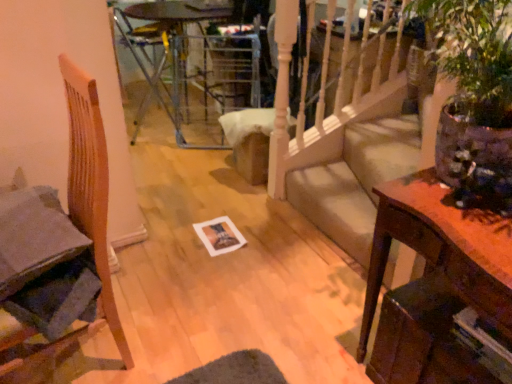
Question: Would you say wooden side table at right is a long distance from wooden chair at left?

Choices:
 (A) no
 (B) yes

Answer: (A)

Question: Is wooden side table at right oriented towards wooden chair at left?

Choices:
 (A) no
 (B) yes

Answer: (A)

Question: From the image's perspective, would you say wooden side table at right is shown under wooden chair at left?

Choices:
 (A) no
 (B) yes

Answer: (B)

Question: From a real-world perspective, is wooden side table at right located higher than wooden chair at left?

Choices:
 (A) yes
 (B) no

Answer: (B)

Question: From a real-world perspective, is wooden side table at right positioned under wooden chair at left based on gravity?

Choices:
 (A) no
 (B) yes

Answer: (B)

Question: Relative to transparent glass table at center, is metallic silver armchair at upper center in front or behind?

Choices:
 (A) behind
 (B) front

Answer: (B)

Question: Is metallic silver armchair at upper center wider or thinner than transparent glass table at center?

Choices:
 (A) thin
 (B) wide

Answer: (A)

Question: From the image's perspective, is metallic silver armchair at upper center located above or below transparent glass table at center?

Choices:
 (A) below
 (B) above

Answer: (A)

Question: Considering the relative positions of metallic silver armchair at upper center and transparent glass table at center in the image provided, is metallic silver armchair at upper center to the left or to the right of transparent glass table at center?

Choices:
 (A) left
 (B) right

Answer: (A)

Question: In terms of size, does transparent glass table at center appear bigger or smaller than wooden side table at right?

Choices:
 (A) big
 (B) small

Answer: (A)

Question: Based on their positions, is transparent glass table at center located to the left or right of wooden side table at right?

Choices:
 (A) left
 (B) right

Answer: (A)

Question: Is transparent glass table at center wider or thinner than wooden side table at right?

Choices:
 (A) thin
 (B) wide

Answer: (B)

Question: From the image's perspective, is transparent glass table at center located above or below wooden side table at right?

Choices:
 (A) above
 (B) below

Answer: (A)

Question: Which is correct: wooden chair at left is inside transparent glass table at center, or outside of it?

Choices:
 (A) outside
 (B) inside

Answer: (A)

Question: From a real-world perspective, is wooden chair at left physically located above or below transparent glass table at center?

Choices:
 (A) below
 (B) above

Answer: (B)